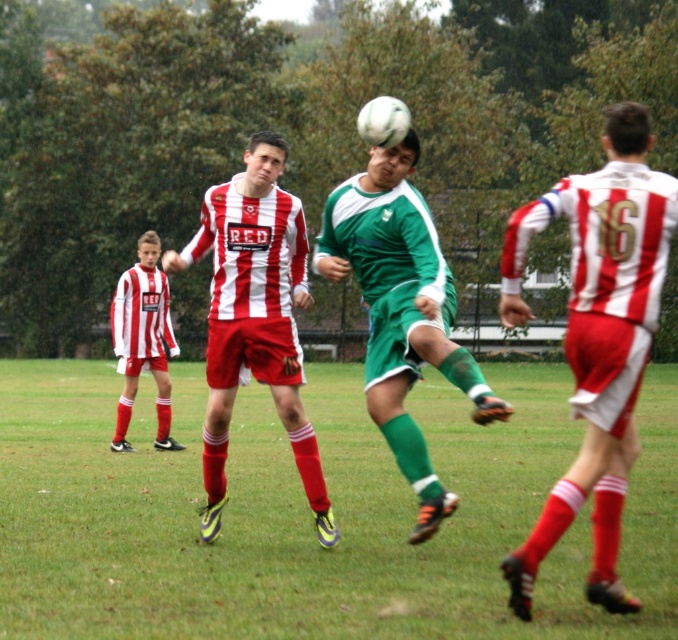
You are a soccer coach analyzing the play. The white matte soccer ball at center is where the action is. The matte red and white jersey at left belongs to an opponent. Can the player in the red and white jersey at left reach the ball before it travels another 5 meters? Explain using the distance provided.

The distance between the white matte soccer ball at center and the matte red and white jersey at left is 8.21 meters. Since the ball needs to travel another 5 meters, the remaining distance to the jersey is 8.21 minus 5 equals 3.21 meters. The player in the matte red and white jersey at left is 3.21 meters away from the ball, so they can likely reach it before it goes 5 more meters.

You are a referee observing the soccer match. You notice the matte red and white striped jersey at center and the green matte soccer ball at center. Which object is positioned to the left of the other?

The matte red and white striped jersey at center is to the left of the green matte soccer ball at center.